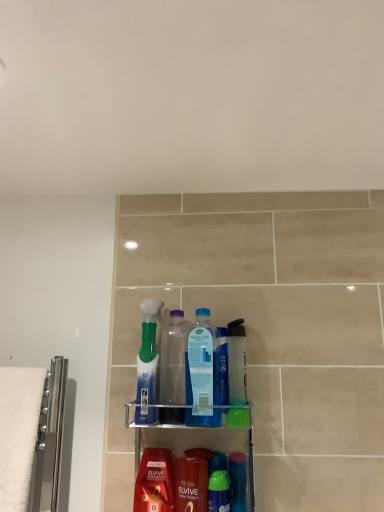
Question: Is shiny red shampoo at lower center further to the viewer compared to translucent plastic bottle at center, which appears as the fourth mouthwash when viewed from the left?

Choices:
 (A) yes
 (B) no

Answer: (B)

Question: From a real-world perspective, is shiny red shampoo at lower center on translucent plastic bottle at center, which is the first mouthwash from right to left?

Choices:
 (A) no
 (B) yes

Answer: (A)

Question: Would you say shiny red shampoo at lower center is outside translucent plastic bottle at center, which appears as the fourth mouthwash when viewed from the left?

Choices:
 (A) no
 (B) yes

Answer: (B)

Question: Is shiny red shampoo at lower center at the left side of translucent plastic bottle at center, which is the first mouthwash from right to left?

Choices:
 (A) yes
 (B) no

Answer: (A)

Question: Considering the relative positions of shiny red shampoo at lower center and translucent plastic bottle at center, which is the first mouthwash from right to left, in the image provided, is shiny red shampoo at lower center in front of translucent plastic bottle at center, which is the first mouthwash from right to left,?

Choices:
 (A) yes
 (B) no

Answer: (A)

Question: Is translucent plastic mouthwash at lower center, arranged as the 2th mouthwash when viewed from the right, situated inside translucent plastic bottles at center or outside?

Choices:
 (A) outside
 (B) inside

Answer: (B)

Question: Visually, is translucent plastic mouthwash at lower center, which is the third mouthwash from left to right, positioned to the left or to the right of translucent plastic bottles at center?

Choices:
 (A) left
 (B) right

Answer: (B)

Question: From a real-world perspective, is translucent plastic mouthwash at lower center, which is the third mouthwash from left to right, positioned above or below translucent plastic bottles at center?

Choices:
 (A) below
 (B) above

Answer: (A)

Question: From the image's perspective, is translucent plastic mouthwash at lower center, arranged as the 2th mouthwash when viewed from the right, located above or below translucent plastic bottles at center?

Choices:
 (A) below
 (B) above

Answer: (A)

Question: Considering the positions of translucent plastic mouthwash at lower center, positioned as the first mouthwash in left-to-right order, and translucent green bottle at center, which is the 3th bottle in right-to-left order, in the image, is translucent plastic mouthwash at lower center, positioned as the first mouthwash in left-to-right order, wider or thinner than translucent green bottle at center, which is the 3th bottle in right-to-left order,?

Choices:
 (A) wide
 (B) thin

Answer: (B)

Question: Considering the positions of point (168, 451) and point (142, 332), is point (168, 451) closer or farther from the camera than point (142, 332)?

Choices:
 (A) closer
 (B) farther

Answer: (B)

Question: Considering their positions, is translucent plastic mouthwash at lower center, which is the fourth mouthwash from right to left, located in front of or behind translucent green bottle at center, which is the 3th bottle in right-to-left order?

Choices:
 (A) behind
 (B) front

Answer: (B)

Question: From a real-world perspective, is translucent plastic mouthwash at lower center, which is the fourth mouthwash from right to left, positioned above or below translucent green bottle at center, the first bottle viewed from the left?

Choices:
 (A) above
 (B) below

Answer: (B)

Question: From a real-world perspective, relative to shiny red shampoo at lower center, is blue plastic bottle at center, marked as the first bottle in a right-to-left arrangement, vertically above or below?

Choices:
 (A) above
 (B) below

Answer: (A)

Question: From their relative heights in the image, would you say blue plastic bottle at center, the 3th bottle in the left-to-right sequence, is taller or shorter than shiny red shampoo at lower center?

Choices:
 (A) tall
 (B) short

Answer: (A)